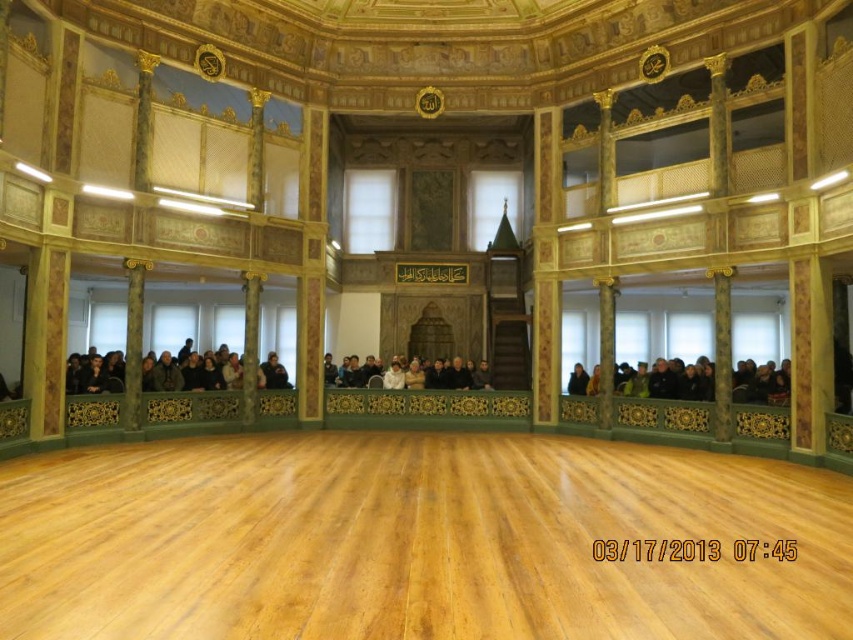
Question: Can you confirm if dark brown wood crowd at lower left is wider than dark gray fabric crowd at center?

Choices:
 (A) yes
 (B) no

Answer: (A)

Question: Can you confirm if dark brown leather jacket at lower right is positioned to the right of dark brown wood crowd at lower left?

Choices:
 (A) no
 (B) yes

Answer: (B)

Question: Can you confirm if dark brown wood crowd at lower left is smaller than dark gray fabric crowd at center?

Choices:
 (A) no
 (B) yes

Answer: (A)

Question: Estimate the real-world distances between objects in this image. Which object is closer to the dark brown wood crowd at lower left?

Choices:
 (A) dark gray fabric crowd at center
 (B) dark brown leather jacket at lower right

Answer: (A)

Question: Estimate the real-world distances between objects in this image. Which object is farther from the dark brown wood crowd at lower left?

Choices:
 (A) dark gray fabric crowd at center
 (B) dark brown leather jacket at lower right

Answer: (B)

Question: Which object appears closest to the camera in this image?

Choices:
 (A) dark brown wood crowd at lower left
 (B) dark brown leather jacket at lower right

Answer: (A)